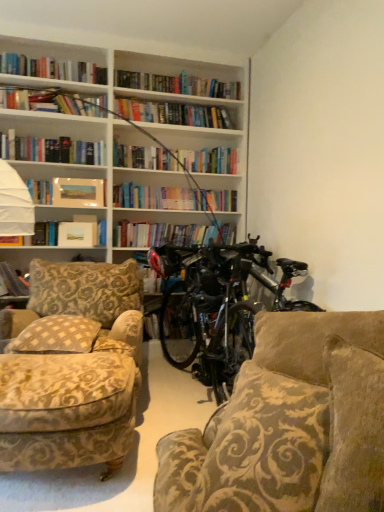
What do you see at coordinates (57, 335) in the screenshot?
I see `beige checkered pillow at left` at bounding box center [57, 335].

What do you see at coordinates (77, 234) in the screenshot? Image resolution: width=384 pixels, height=512 pixels. I see `matte paper paperback book at upper left` at bounding box center [77, 234].

The height and width of the screenshot is (512, 384). What do you see at coordinates (216, 306) in the screenshot?
I see `shiny black bicycle at center` at bounding box center [216, 306].

Identify the location of velvet beige armchair at lower left. Image resolution: width=384 pixels, height=512 pixels. (71, 361).

At what (x,y) coordinates should I click in order to perform the action: click on beige checkered pillow at left. Please return your answer as a coordinate pair (x, y). The height and width of the screenshot is (512, 384). Looking at the image, I should click on click(57, 335).

From a real-world perspective, is velvet beige armchair at lower left above or below beige checkered pillow at left?

velvet beige armchair at lower left is below beige checkered pillow at left.

Consider the image. In terms of width, does velvet beige armchair at lower left look wider or thinner when compared to beige checkered pillow at left?

Clearly, velvet beige armchair at lower left has more width compared to beige checkered pillow at left.

Is velvet beige armchair at lower left oriented towards beige checkered pillow at left?

No, velvet beige armchair at lower left does not turn towards beige checkered pillow at left.

Does point (82, 232) appear closer or farther from the camera than point (80, 430)?

Point (82, 232).

Which of these two, matte paper paperback book at upper left or velvet beige armchair at lower left, stands taller?

Standing taller between the two is velvet beige armchair at lower left.

Which object is more forward, matte paper paperback book at upper left or velvet beige armchair at lower left?

Positioned in front is velvet beige armchair at lower left.

How many degrees apart are the facing directions of hardcover book at left, which appears as the 2th book when viewed from the right, and beige checkered pillow at left?

There is a 14.4-degree angle between the facing directions of hardcover book at left, which appears as the 2th book when viewed from the right, and beige checkered pillow at left.

Can you see hardcover book at left, which appears as the 2th book when viewed from the right, touching beige checkered pillow at left?

No, hardcover book at left, which appears as the 2th book when viewed from the right, is not touching beige checkered pillow at left.

Considering the sizes of objects hardcover book at left, which ranks as the 1th book in bottom-to-top order, and beige checkered pillow at left in the image provided, who is smaller, hardcover book at left, which ranks as the 1th book in bottom-to-top order, or beige checkered pillow at left?

With smaller size is hardcover book at left, which ranks as the 1th book in bottom-to-top order.

From the image's perspective, relative to beige checkered pillow at left, is hardcover book at left, which appears as the 2th book when viewed from the right, above or below?

Based on their image positions, hardcover book at left, which appears as the 2th book when viewed from the right, is located above beige checkered pillow at left.

Is velvet beige armchair at lower left positioned with its back to matte paper photo frame at upper left, which is the 1th book in top-to-bottom order?

No, velvet beige armchair at lower left is not facing the opposite direction of matte paper photo frame at upper left, which is the 1th book in top-to-bottom order.

Which is more to the right, velvet beige armchair at lower left or matte paper photo frame at upper left, which is the 1th book in top-to-bottom order?

From the viewer's perspective, velvet beige armchair at lower left appears more on the right side.

Is velvet beige armchair at lower left positioned far away from matte paper photo frame at upper left, the 2th book in the bottom-to-top sequence?

velvet beige armchair at lower left is far away from matte paper photo frame at upper left, the 2th book in the bottom-to-top sequence.

Which is more to the right, shiny black bicycle at center or hardcover book at left, which appears as the 2th book when viewed from the right?

From the viewer's perspective, shiny black bicycle at center appears more on the right side.

Considering the positions of objects shiny black bicycle at center and hardcover book at left, marked as the second book in a top-to-bottom arrangement, in the image provided, who is in front, shiny black bicycle at center or hardcover book at left, marked as the second book in a top-to-bottom arrangement,?

shiny black bicycle at center is closer to the camera.

Is shiny black bicycle at center turned away from hardcover book at left, marked as the second book in a top-to-bottom arrangement?

shiny black bicycle at center is not turned away from hardcover book at left, marked as the second book in a top-to-bottom arrangement.

From the image's perspective, is shiny black bicycle at center on top of hardcover book at left, the first book in the left-to-right sequence?

No.

Which object is further away from the camera taking this photo, velvet beige armchair at lower left or velvet-patterned couch at right?

Positioned behind is velvet beige armchair at lower left.

In the image, is velvet beige armchair at lower left on the left side or the right side of velvet-patterned couch at right?

Clearly, velvet beige armchair at lower left is on the left of velvet-patterned couch at right in the image.

Which is in front, point (105, 398) or point (375, 435)?

The point (375, 435) is closer.

Considering the sizes of objects velvet beige armchair at lower left and velvet-patterned couch at right in the image provided, who is smaller, velvet beige armchair at lower left or velvet-patterned couch at right?

With smaller size is velvet-patterned couch at right.

Is beige checkered pillow at left next to velvet-patterned couch at right and touching it?

No, beige checkered pillow at left is not in contact with velvet-patterned couch at right.

Is beige checkered pillow at left thinner than velvet-patterned couch at right?

Yes, beige checkered pillow at left is thinner than velvet-patterned couch at right.

Relative to velvet-patterned couch at right, is beige checkered pillow at left in front or behind?

beige checkered pillow at left is behind velvet-patterned couch at right.

The image size is (384, 512). Find the location of `pillow that is on the left side of velvet beige armchair at lower left`. pillow that is on the left side of velvet beige armchair at lower left is located at coordinates (57, 335).

Identify the location of chair that appears below the matte paper paperback book at upper left (from the image's perspective). The height and width of the screenshot is (512, 384). (x=71, y=361).

Looking at the image, which one is located further to matte paper photo frame at upper left, which is the 1th book in top-to-bottom order, beige checkered pillow at left or hardcover book at left, which appears as the 2th book when viewed from the right?

The object further to matte paper photo frame at upper left, which is the 1th book in top-to-bottom order, is beige checkered pillow at left.

From the image, which object appears to be farther from velvet-patterned couch at right, beige checkered pillow at left or shiny black bicycle at center?

The object further to velvet-patterned couch at right is shiny black bicycle at center.

Which object lies nearer to the anchor point beige checkered pillow at left, hardcover book at left, which ranks as the 1th book in bottom-to-top order, or matte paper paperback book at upper left?

hardcover book at left, which ranks as the 1th book in bottom-to-top order, is closer to beige checkered pillow at left.

Which object lies further to the anchor point matte paper paperback book at upper left, beige checkered pillow at left or hardcover book at left, which appears as the 2th book when viewed from the right?

The object further to matte paper paperback book at upper left is beige checkered pillow at left.

Which object lies nearer to the anchor point beige checkered pillow at left, matte paper paperback book at upper left or velvet beige armchair at lower left?

Based on the image, velvet beige armchair at lower left appears to be nearer to beige checkered pillow at left.

Which object lies further to the anchor point shiny black bicycle at center, velvet beige armchair at lower left or hardcover book at left, the first book in the left-to-right sequence?

hardcover book at left, the first book in the left-to-right sequence.

Considering their positions, is matte paper paperback book at upper left positioned further to shiny black bicycle at center than velvet beige armchair at lower left?

matte paper paperback book at upper left lies further to shiny black bicycle at center than the other object.

When comparing their distances from matte paper paperback book at upper left, does beige checkered pillow at left or velvet beige armchair at lower left seem closer?

beige checkered pillow at left lies closer to matte paper paperback book at upper left than the other object.

Image resolution: width=384 pixels, height=512 pixels. Find the location of `book located between velvet beige armchair at lower left and matte paper photo frame at upper left, placed as the 2th book when sorted from left to right, in the depth direction`. book located between velvet beige armchair at lower left and matte paper photo frame at upper left, placed as the 2th book when sorted from left to right, in the depth direction is located at coordinates (13, 281).

Locate an element on the screen. Image resolution: width=384 pixels, height=512 pixels. pillow between velvet-patterned couch at right and matte paper photo frame at upper left, placed as the 2th book when sorted from left to right, from front to back is located at coordinates (57, 335).

Locate an element on the screen. The height and width of the screenshot is (512, 384). paperback book between hardcover book at left, which ranks as the 1th book in bottom-to-top order, and shiny black bicycle at center from left to right is located at coordinates (77, 234).

Find the location of `pillow between velvet beige armchair at lower left and matte paper paperback book at upper left in the front-back direction`. pillow between velvet beige armchair at lower left and matte paper paperback book at upper left in the front-back direction is located at coordinates (57, 335).